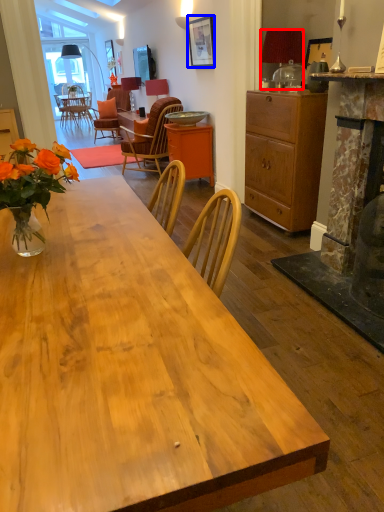
Question: Which object is closer to the camera taking this photo, lamp (highlighted by a red box) or picture frame (highlighted by a blue box)?

Choices:
 (A) lamp
 (B) picture frame

Answer: (A)